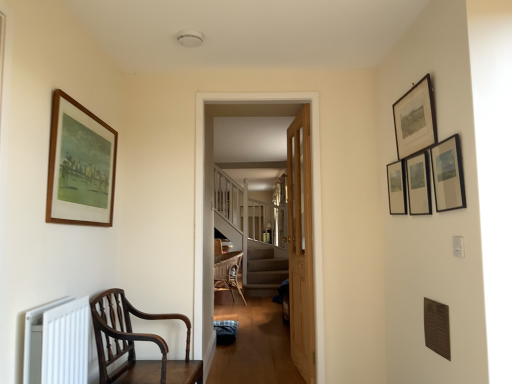
Question: From the image's perspective, is mahogany wood chair at lower left located above matte black picture frame at upper right, which ranks as the third picture frame in left-to-right order?

Choices:
 (A) yes
 (B) no

Answer: (B)

Question: Is mahogany wood chair at lower left positioned before matte black picture frame at upper right, which ranks as the third picture frame in left-to-right order?

Choices:
 (A) yes
 (B) no

Answer: (A)

Question: Considering the relative positions of mahogany wood chair at lower left and matte black picture frame at upper right, which ranks as the third picture frame in left-to-right order, in the image provided, is mahogany wood chair at lower left to the right of matte black picture frame at upper right, which ranks as the third picture frame in left-to-right order, from the viewer's perspective?

Choices:
 (A) no
 (B) yes

Answer: (A)

Question: Considering the relative positions of mahogany wood chair at lower left and matte black picture frame at upper right, the third picture frame from the right, in the image provided, is mahogany wood chair at lower left to the left of matte black picture frame at upper right, the third picture frame from the right, from the viewer's perspective?

Choices:
 (A) no
 (B) yes

Answer: (B)

Question: Is mahogany wood chair at lower left aimed at matte black picture frame at upper right, the third picture frame from the right?

Choices:
 (A) yes
 (B) no

Answer: (B)

Question: In terms of width, does matte black picture frame at upper right, marked as the fifth picture frame in a left-to-right arrangement, look wider or thinner when compared to wooden door at center?

Choices:
 (A) wide
 (B) thin

Answer: (B)

Question: From a real-world perspective, is matte black picture frame at upper right, marked as the fifth picture frame in a left-to-right arrangement, physically located above or below wooden door at center?

Choices:
 (A) below
 (B) above

Answer: (B)

Question: Considering their positions, is matte black picture frame at upper right, the 1th picture frame in the right-to-left sequence, located in front of or behind wooden door at center?

Choices:
 (A) behind
 (B) front

Answer: (B)

Question: Considering the positions of matte black picture frame at upper right, marked as the fifth picture frame in a left-to-right arrangement, and wooden door at center in the image, is matte black picture frame at upper right, marked as the fifth picture frame in a left-to-right arrangement, taller or shorter than wooden door at center?

Choices:
 (A) short
 (B) tall

Answer: (A)

Question: Is matte black picture frame at upper right, placed as the second picture frame when sorted from right to left, spatially inside matte black picture frame at upper right, the third picture frame from the right, or outside of it?

Choices:
 (A) outside
 (B) inside

Answer: (A)

Question: From the image's perspective, relative to matte black picture frame at upper right, the third picture frame from the right, is matte black picture frame at upper right, placed as the fourth picture frame when sorted from left to right, above or below?

Choices:
 (A) below
 (B) above

Answer: (B)

Question: Is matte black picture frame at upper right, placed as the fourth picture frame when sorted from left to right, wider or thinner than matte black picture frame at upper right, which ranks as the third picture frame in left-to-right order?

Choices:
 (A) thin
 (B) wide

Answer: (B)

Question: Considering the positions of matte black picture frame at upper right, placed as the fourth picture frame when sorted from left to right, and matte black picture frame at upper right, the third picture frame from the right, in the image, is matte black picture frame at upper right, placed as the fourth picture frame when sorted from left to right, bigger or smaller than matte black picture frame at upper right, the third picture frame from the right,?

Choices:
 (A) small
 (B) big

Answer: (B)

Question: Looking at the image, does wooden picture frame at upper right, the fourth picture frame when ordered from right to left, seem bigger or smaller compared to white matte radiator at lower left?

Choices:
 (A) small
 (B) big

Answer: (A)

Question: From the image's perspective, is wooden picture frame at upper right, the fourth picture frame when ordered from right to left, above or below white matte radiator at lower left?

Choices:
 (A) below
 (B) above

Answer: (B)